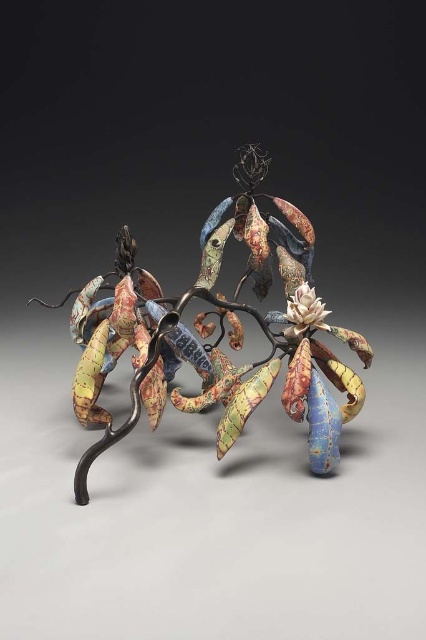
Does textured ceramic leaves at center come behind white matte flower at center?

No.

Does point (357, 388) lie in front of point (327, 326)?

No, it is behind (327, 326).

This screenshot has width=426, height=640. Identify the location of textured ceramic leaves at center. tap(219, 332).